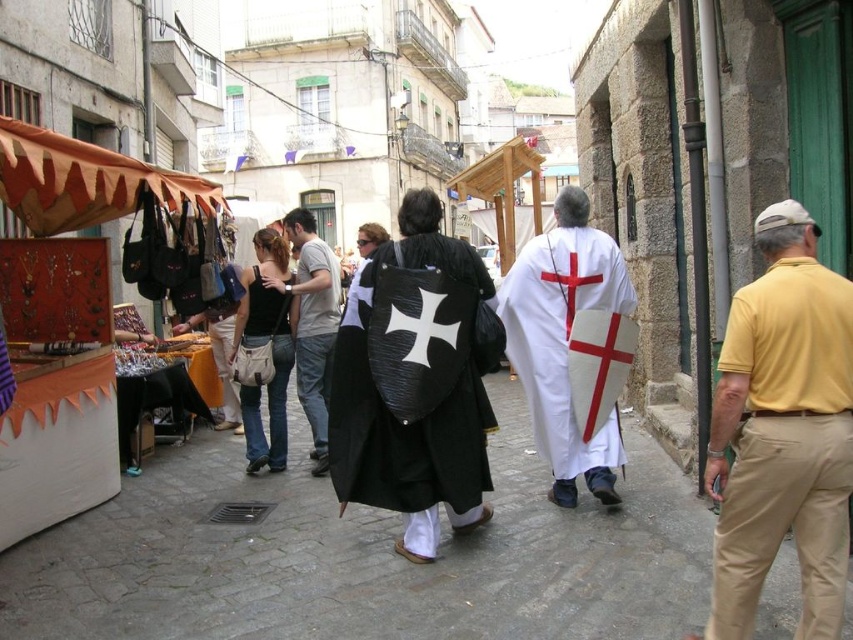
Between yellow cotton shirt at right and light gray cotton t-shirt at center, which one appears on the right side from the viewer's perspective?

yellow cotton shirt at right

Can you confirm if yellow cotton shirt at right is positioned to the right of light gray cotton t-shirt at center?

Indeed, yellow cotton shirt at right is positioned on the right side of light gray cotton t-shirt at center.

Which is behind, point (717, 380) or point (310, 384)?

The point (310, 384) is more distant.

I want to click on yellow cotton shirt at right, so click(782, 432).

Does yellow cotton shirt at right lie behind white matte shield at center?

No.

Who is lower down, yellow cotton shirt at right or white matte shield at center?

yellow cotton shirt at right is lower down.

Is point (833, 544) more distant than point (550, 252)?

No, it is not.

Locate an element on the screen. The image size is (853, 640). yellow cotton shirt at right is located at coordinates (782, 432).

Is black matte shield at center further to camera compared to black canvas bag at center?

No, it is not.

Can you confirm if black matte shield at center is positioned below black canvas bag at center?

No, black matte shield at center is not below black canvas bag at center.

Is point (332, 371) less distant than point (282, 372)?

That is True.

I want to click on black matte shield at center, so click(405, 435).